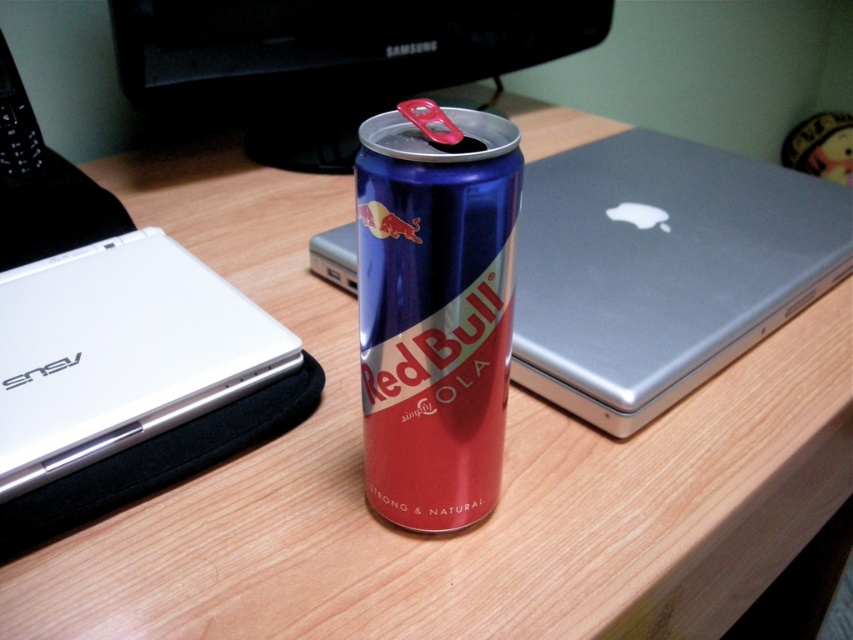
Question: Among these objects, which one is nearest to the camera?

Choices:
 (A) sleek silver laptop at center
 (B) metallic blue can at center
 (C) metallic silver laptop at center
 (D) white matte laptop at left

Answer: (B)

Question: Can you confirm if metallic silver laptop at center is positioned below white matte laptop at left?

Choices:
 (A) no
 (B) yes

Answer: (A)

Question: Is sleek silver laptop at center wider than metallic silver laptop at center?

Choices:
 (A) no
 (B) yes

Answer: (A)

Question: Which object is the farthest from the white matte laptop at left?

Choices:
 (A) metallic blue can at center
 (B) metallic silver laptop at center

Answer: (B)

Question: Does sleek silver laptop at center have a larger size compared to metallic blue can at center?

Choices:
 (A) yes
 (B) no

Answer: (A)

Question: Which of the following is the farthest from the observer?

Choices:
 (A) white matte laptop at left
 (B) metallic blue can at center

Answer: (A)